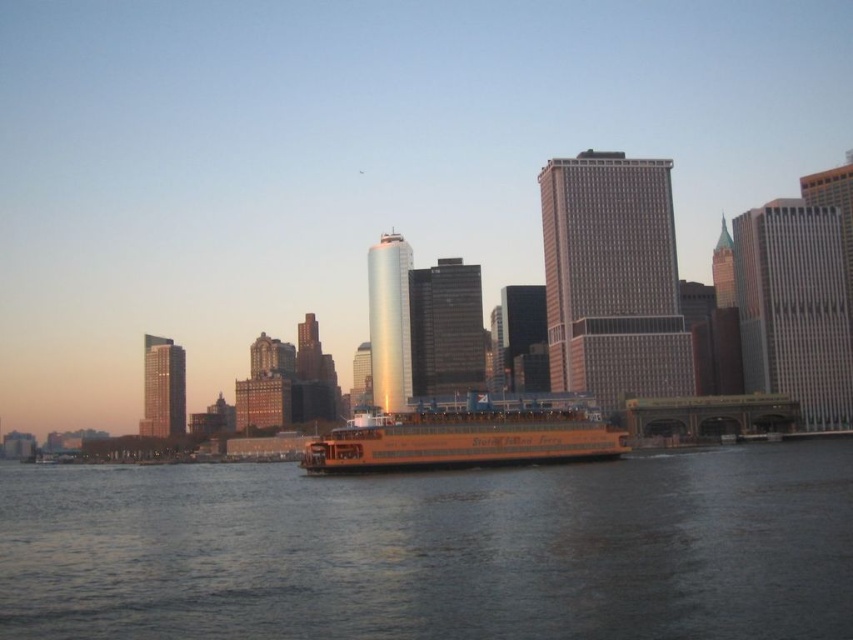
Which is in front, point (491, 484) or point (471, 432)?

Positioned in front is point (491, 484).

Does brown water at center have a greater width compared to yellow matte ferry at center?

Yes.

Does point (505, 531) come behind point (540, 449)?

No, (505, 531) is closer to viewer.

Find the location of a particular element. The width and height of the screenshot is (853, 640). brown water at center is located at coordinates (434, 550).